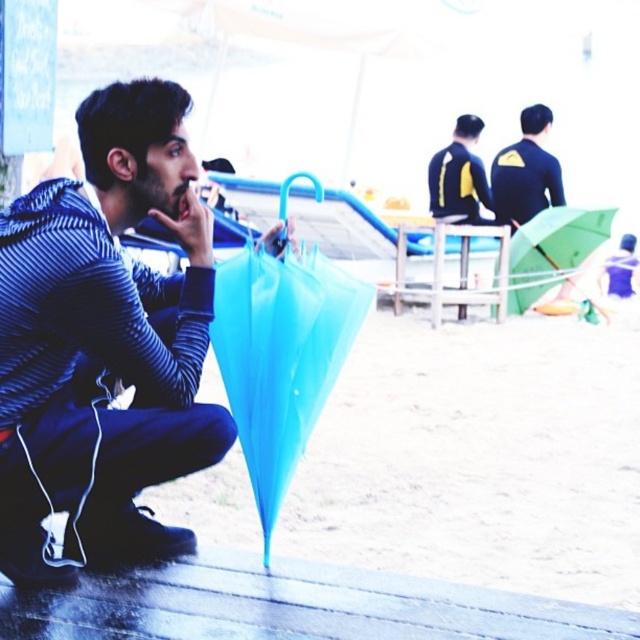
You are standing at the beach and want to reach the point marked as point (x=518, y=152). If you walk straight ahead, how far will you have to walk to reach that point?

The distance between you and point (x=518, y=152) is 7.09 meters, so you will have to walk 7.09 meters straight ahead to reach it.

You are standing at the origin point of the coordinate system in the image. You see a matte black wetsuit at upper right located at point (525, 172). If you want to walk directly towards it, which direction should you move in?

You should move towards the upper right direction to reach the matte black wetsuit at upper right located at point (525, 172).